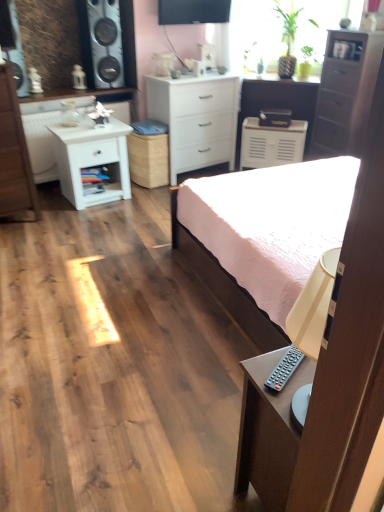
You are a GUI agent. You are given a task and a screenshot of the screen. Output one action in this format:
    pyautogui.click(x=<x>, y=<y>)
    Task: Click on the vacant area on top of white matte cabinet at center (from a real-world perspective)
    The image size is (384, 512).
    Given the screenshot: What is the action you would take?
    pyautogui.click(x=271, y=113)